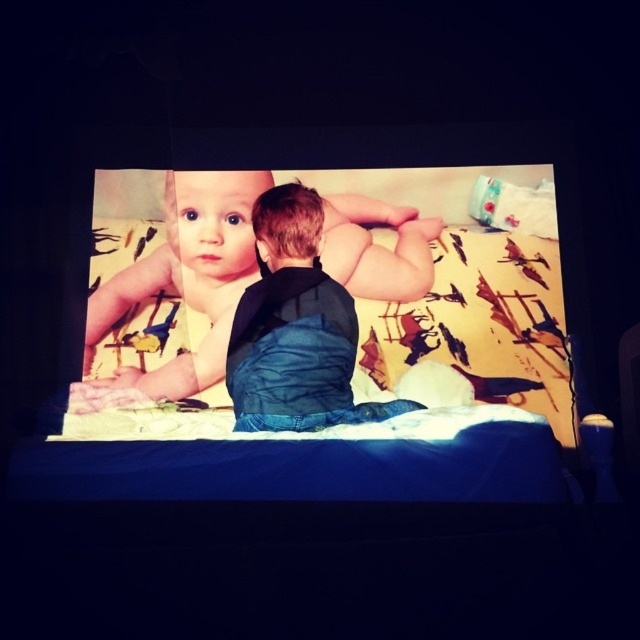
Does smooth skin baby at center have a greater height compared to denim jacket at center?

Yes.

Does smooth skin baby at center have a lesser height compared to denim jacket at center?

No, smooth skin baby at center is not shorter than denim jacket at center.

Describe the element at coordinates (188, 276) in the screenshot. The image size is (640, 640). I see `smooth skin baby at center` at that location.

This screenshot has height=640, width=640. In order to click on smooth skin baby at center in this screenshot , I will do `click(188, 276)`.

From the picture: Does yellow fabric bed at center have a smaller size compared to white fabric diaper at upper right?

Incorrect, yellow fabric bed at center is not smaller in size than white fabric diaper at upper right.

Between point (490, 397) and point (534, 204), which one is positioned behind?

Positioned behind is point (534, 204).

Between point (397, 314) and point (509, 184), which one is positioned behind?

Positioned behind is point (509, 184).

Locate an element on the screen. The image size is (640, 640). yellow fabric bed at center is located at coordinates (356, 348).

Who is shorter, denim jacket at center or white fabric diaper at upper right?

white fabric diaper at upper right

Is denim jacket at center taller than white fabric diaper at upper right?

Yes, denim jacket at center is taller than white fabric diaper at upper right.

Identify the location of denim jacket at center. The width and height of the screenshot is (640, 640). (296, 328).

Locate an element on the screen. The image size is (640, 640). denim jacket at center is located at coordinates (296, 328).